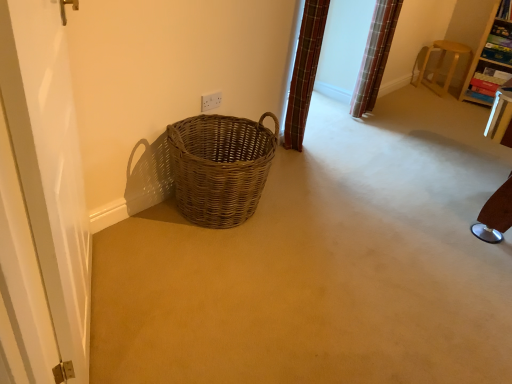
Locate an element on the screen. empty space that is to the right of plaid fabric curtain at upper right, which is the second curtain from left to right is located at coordinates (392, 111).